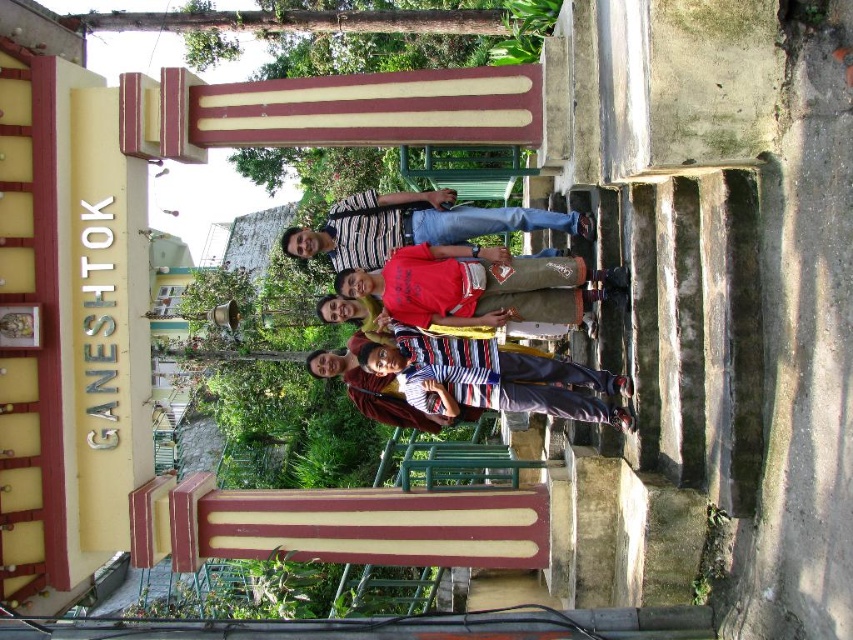
Which is in front, point (383, 294) or point (496, 392)?

Point (496, 392)

Is point (585, 278) closer to viewer compared to point (413, 326)?

Yes, it is in front of point (413, 326).

You are a GUI agent. You are given a task and a screenshot of the screen. Output one action in this format:
    pyautogui.click(x=<x>, y=<y>)
    Task: Click on the red cotton shirt at center
    
    Given the screenshot: What is the action you would take?
    pyautogui.click(x=479, y=285)

Does striped shirt at center have a smaller size compared to green metal ladder at center?

Actually, striped shirt at center might be larger than green metal ladder at center.

Is striped shirt at center thinner than green metal ladder at center?

In fact, striped shirt at center might be wider than green metal ladder at center.

Where is `striped shirt at center`? Image resolution: width=853 pixels, height=640 pixels. striped shirt at center is located at coordinates click(415, 225).

Identify the location of striped shirt at center. (415, 225).

Is red cotton shirt at center to the left of green metal ladder at center from the viewer's perspective?

Incorrect, red cotton shirt at center is not on the left side of green metal ladder at center.

Between red cotton shirt at center and green metal ladder at center, which one is positioned higher?

red cotton shirt at center is higher up.

Locate an element on the screen. red cotton shirt at center is located at coordinates (479, 285).